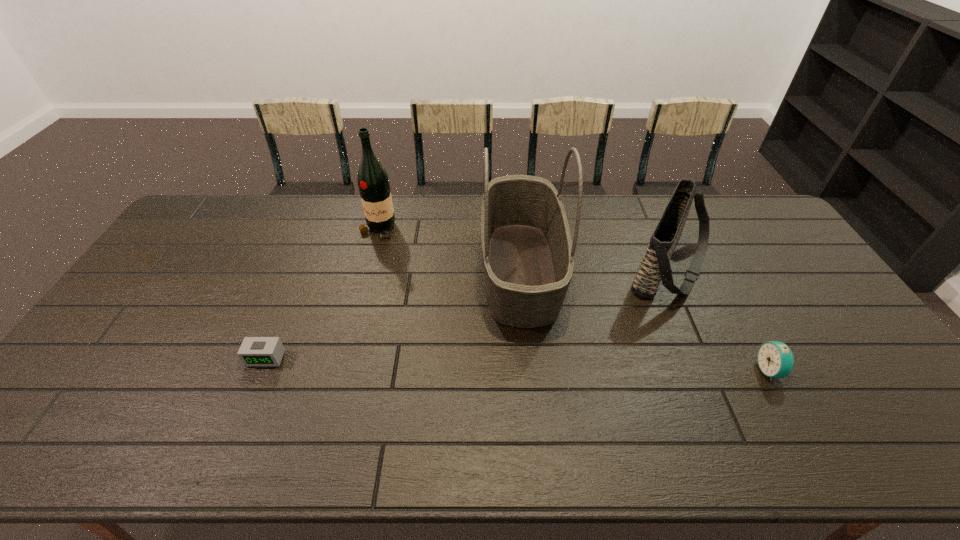
Find the location of a particular element. This screenshot has width=960, height=540. basket is located at coordinates (527, 250).

Where is `the fourth object from right to left`? The width and height of the screenshot is (960, 540). the fourth object from right to left is located at coordinates (373, 182).

The height and width of the screenshot is (540, 960). I want to click on the fourth shortest object, so click(373, 182).

I want to click on handbag, so click(x=655, y=266).

You are a GUI agent. You are given a task and a screenshot of the screen. Output one action in this format:
    pyautogui.click(x=<x>, y=<y>)
    Task: Click on the right alarm clock
    This screenshot has width=960, height=540.
    Given the screenshot: What is the action you would take?
    775,359

Find the location of `the taller alarm clock`. the taller alarm clock is located at coordinates (775, 359).

At what (x,y) coordinates should I click in order to perform the action: click on the left alarm clock. Please return your answer as a coordinate pair (x, y). Looking at the image, I should click on (254, 351).

The image size is (960, 540). Find the location of `the shorter alarm clock`. the shorter alarm clock is located at coordinates (254, 351).

I want to click on vacant region located on the right of the third object from left to right, so click(587, 269).

Identify the location of blank area located on the front of the fourth object from right to left. (363, 284).